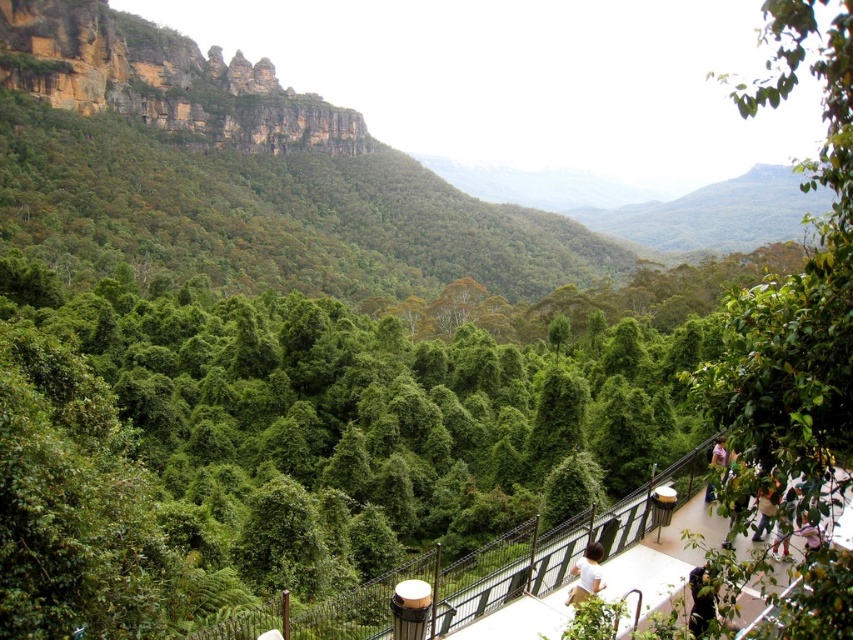
You are standing on the viewing platform and see the white matte person at lower right and the pink fabric person at lower right. Which one is positioned more to the right side?

The white matte person at lower right is positioned more to the right side than the pink fabric person at lower right.

You are standing on the viewing platform and want to take a photo of the green leafy forest at upper left. Based on its 2D location coordinates, where should you aim your camera to capture it in the frame?

The green leafy forest at upper left is located at coordinates point (236, 176), so aim your camera towards the upper left area of the frame at that specific coordinate point to capture it.